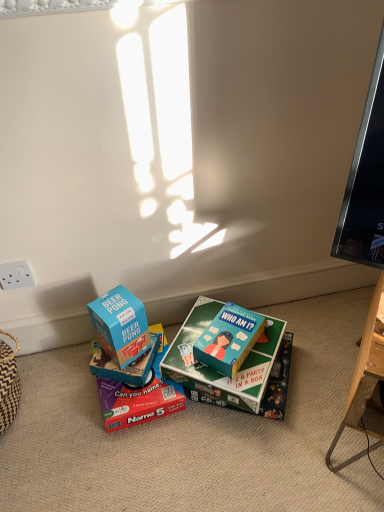
At what (x,y) coordinates should I click in order to perform the action: click on vacant area in front of blue cardboard box at center, the second box when ordered from left to right. Please return your answer as a coordinate pair (x, y). The height and width of the screenshot is (512, 384). Looking at the image, I should click on (128, 399).